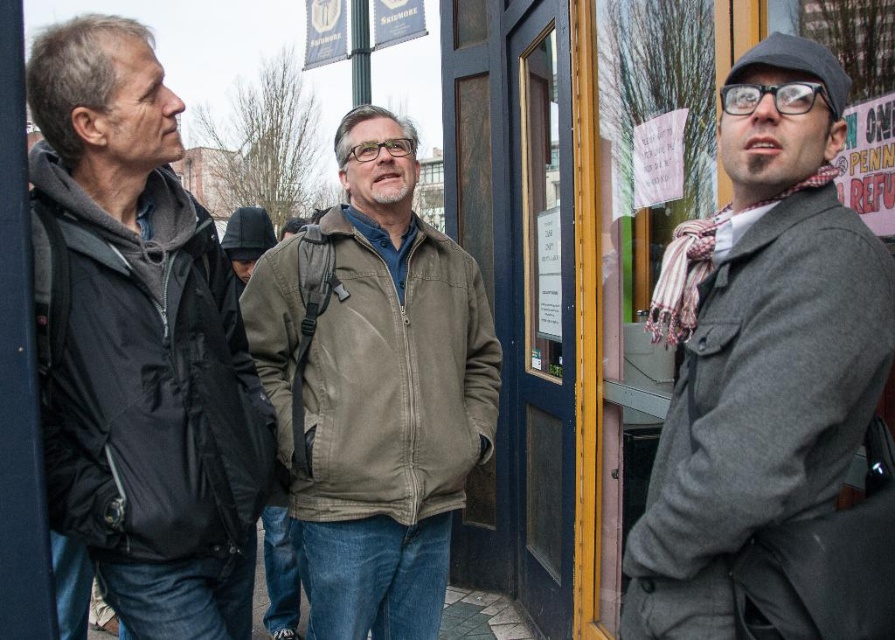
Question: Which of the following is the farthest from the observer?

Choices:
 (A) (821, 116)
 (B) (177, 324)

Answer: (B)

Question: Does gray wool coat at right appear over black matte jacket at left?

Choices:
 (A) no
 (B) yes

Answer: (A)

Question: Is gray wool coat at right above black matte jacket at left?

Choices:
 (A) yes
 (B) no

Answer: (B)

Question: Which of these objects is positioned closest to the gray wool coat at right?

Choices:
 (A) black matte jacket at left
 (B) olive-green corduroy jacket at center

Answer: (B)

Question: Is gray wool coat at right to the right of olive-green corduroy jacket at center from the viewer's perspective?

Choices:
 (A) no
 (B) yes

Answer: (B)

Question: Which object is closer to the camera taking this photo?

Choices:
 (A) olive-green corduroy jacket at center
 (B) gray wool coat at right
 (C) black matte jacket at left

Answer: (B)